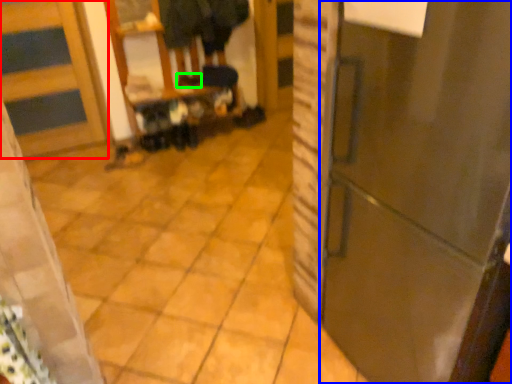
Question: Which is nearer to the door (highlighted by a red box)? door (highlighted by a blue box) or shoe (highlighted by a green box).

Choices:
 (A) door
 (B) shoe

Answer: (B)